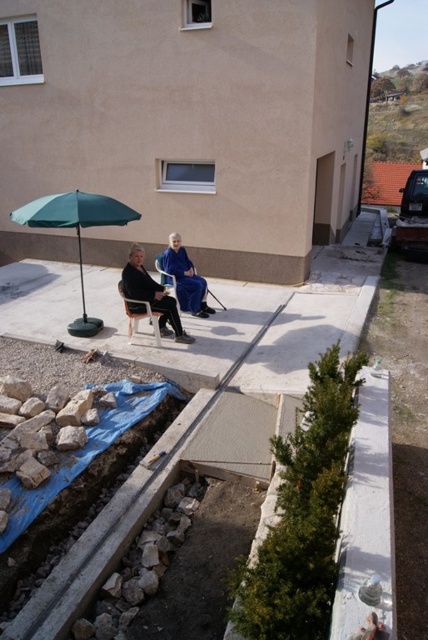
You are standing at the center of the patio and want to move towards the green fabric umbrella at left. What direction should you move in?

Since the green fabric umbrella at left is located at coordinates point [76,230], you should move towards the left direction to reach it.

You are a photographer setting up for a photoshoot on the patio. You have a blue fabric dress at center and a wooden folding chair at center. Which object should you place first if you want the larger item closer to the camera?

You should place the blue fabric dress at center first since it has a larger size compared to the wooden folding chair at center, ensuring it is positioned closer to the camera as desired.